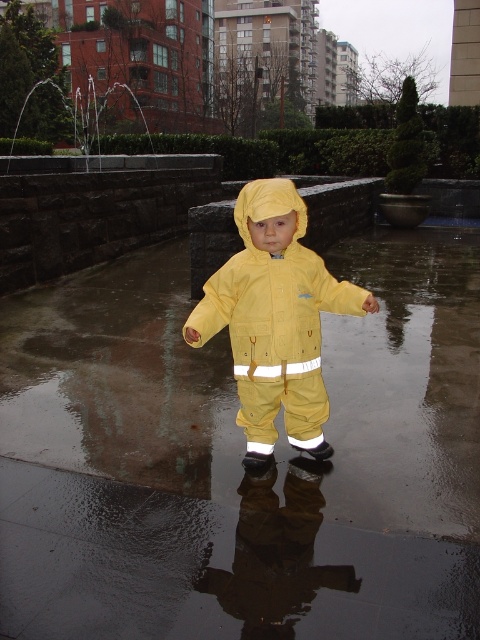
You are a delivery robot that needs to deliver a package to the glossy concrete pavement at center. You are currently at the yellow matte rain suit at center. Can you move directly towards the pavement without any obstacles between them?

The distance between the glossy concrete pavement at center and the yellow matte rain suit at center is 73.73 centimeters. Since there are no obstacles mentioned in the scene description, the robot can move directly towards the pavement.

You are a delivery robot that needs to place a package on the glossy concrete pavement at center. However, you must ensure that the package doesn not touch the yellow matte rain suit at center. Is this possible?

The glossy concrete pavement at center is below the yellow matte rain suit at center, so placing the package on the pavement would mean it is under the rain suit, making it impossible to avoid contact. Therefore, the package cannot be placed there without touching the yellow matte rain suit at center.

You are a photographer trying to capture the child in the bright yellow rain suit. You notice two points in the image at coordinates point (x=334, y=588) and point (x=276, y=294). Which point is nearer to you as you take the photo?

Point (x=334, y=588) is closer to the viewer than point (x=276, y=294).